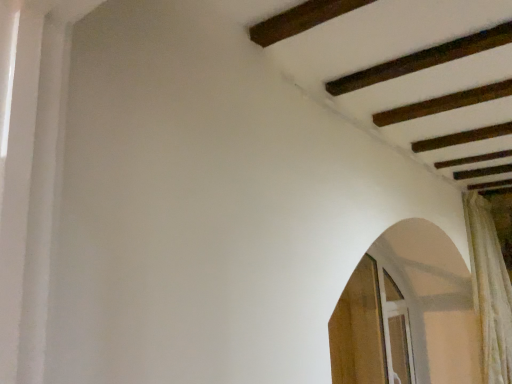
Measure the distance between white textured curtain at right and camera.

white textured curtain at right is 9.02 feet away from camera.

Image resolution: width=512 pixels, height=384 pixels. Describe the element at coordinates (359, 330) in the screenshot. I see `wooden screen door at lower right, the second screen door viewed from the right` at that location.

Find the location of `white textured curtain at right`. white textured curtain at right is located at coordinates (489, 289).

In the scene shown: Is clear glass screen door at lower right, which is counted as the first screen door, starting from the right, turned away from wooden screen door at lower right, positioned as the first screen door in left-to-right order?

Yes, wooden screen door at lower right, positioned as the first screen door in left-to-right order, is at the back of clear glass screen door at lower right, which is counted as the first screen door, starting from the right.

Can you confirm if clear glass screen door at lower right, which is counted as the first screen door, starting from the right, is shorter than wooden screen door at lower right, the second screen door viewed from the right?

Indeed, clear glass screen door at lower right, which is counted as the first screen door, starting from the right, has a lesser height compared to wooden screen door at lower right, the second screen door viewed from the right.

From the image's perspective, is clear glass screen door at lower right, which ranks as the 2th screen door in left-to-right order, above wooden screen door at lower right, positioned as the first screen door in left-to-right order?

No.

How many degrees apart are the facing directions of white textured curtain at right and wooden screen door at lower right, positioned as the first screen door in left-to-right order?

0.694 degrees separate the facing orientations of white textured curtain at right and wooden screen door at lower right, positioned as the first screen door in left-to-right order.

Is there a large distance between white textured curtain at right and wooden screen door at lower right, positioned as the first screen door in left-to-right order?

That's not correct — white textured curtain at right is a little close to wooden screen door at lower right, positioned as the first screen door in left-to-right order.

Considering the sizes of white textured curtain at right and wooden screen door at lower right, the second screen door viewed from the right, in the image, is white textured curtain at right bigger or smaller than wooden screen door at lower right, the second screen door viewed from the right,?

Considering their sizes, white textured curtain at right takes up more space than wooden screen door at lower right, the second screen door viewed from the right.

From their relative heights in the image, would you say white textured curtain at right is taller or shorter than wooden screen door at lower right, the second screen door viewed from the right?

Clearly, white textured curtain at right is taller compared to wooden screen door at lower right, the second screen door viewed from the right.

Which is correct: white textured curtain at right is inside clear glass screen door at lower right, which ranks as the 2th screen door in left-to-right order, or outside of it?

white textured curtain at right is spatially situated outside clear glass screen door at lower right, which ranks as the 2th screen door in left-to-right order.

Which object is thinner, white textured curtain at right or clear glass screen door at lower right, which ranks as the 2th screen door in left-to-right order?

clear glass screen door at lower right, which ranks as the 2th screen door in left-to-right order, is thinner.

Which is less distant, [490,354] or [391,291]?

Point [490,354].

Is white textured curtain at right in front of clear glass screen door at lower right, which is counted as the first screen door, starting from the right?

Yes, white textured curtain at right is closer to the viewer.

Which object is further away from the camera, wooden screen door at lower right, positioned as the first screen door in left-to-right order, or white textured curtain at right?

Positioned behind is white textured curtain at right.

From the image's perspective, is wooden screen door at lower right, positioned as the first screen door in left-to-right order, beneath white textured curtain at right?

Indeed, from the image's perspective, wooden screen door at lower right, positioned as the first screen door in left-to-right order, is shown beneath white textured curtain at right.

Considering the points (367, 357) and (501, 324), which point is behind, point (367, 357) or point (501, 324)?

Positioned behind is point (367, 357).

Which is more to the left, wooden screen door at lower right, the second screen door viewed from the right, or white textured curtain at right?

wooden screen door at lower right, the second screen door viewed from the right, is more to the left.

Is clear glass screen door at lower right, which is counted as the first screen door, starting from the right, turned away from white textured curtain at right?

clear glass screen door at lower right, which is counted as the first screen door, starting from the right, does not have its back to white textured curtain at right.

From a real-world perspective, is clear glass screen door at lower right, which ranks as the 2th screen door in left-to-right order, physically below white textured curtain at right?

Yes, from a real-world perspective, clear glass screen door at lower right, which ranks as the 2th screen door in left-to-right order, is below white textured curtain at right.

Is clear glass screen door at lower right, which is counted as the first screen door, starting from the right, inside or outside of white textured curtain at right?

clear glass screen door at lower right, which is counted as the first screen door, starting from the right, is not enclosed by white textured curtain at right.

Is the depth of clear glass screen door at lower right, which ranks as the 2th screen door in left-to-right order, less than that of white textured curtain at right?

No, clear glass screen door at lower right, which ranks as the 2th screen door in left-to-right order, is further to the viewer.

From a real-world perspective, is wooden screen door at lower right, positioned as the first screen door in left-to-right order, over clear glass screen door at lower right, which ranks as the 2th screen door in left-to-right order?

Yes, from a real-world perspective, wooden screen door at lower right, positioned as the first screen door in left-to-right order, is on top of clear glass screen door at lower right, which ranks as the 2th screen door in left-to-right order.

Which is in front, point (357, 331) or point (399, 323)?

Point (399, 323)

From the image's perspective, is wooden screen door at lower right, the second screen door viewed from the right, positioned above or below clear glass screen door at lower right, which ranks as the 2th screen door in left-to-right order?

wooden screen door at lower right, the second screen door viewed from the right, is situated higher than clear glass screen door at lower right, which ranks as the 2th screen door in left-to-right order, in the image.

Is wooden screen door at lower right, positioned as the first screen door in left-to-right order, facing towards clear glass screen door at lower right, which is counted as the first screen door, starting from the right?

Yes, wooden screen door at lower right, positioned as the first screen door in left-to-right order, is aimed at clear glass screen door at lower right, which is counted as the first screen door, starting from the right.

The height and width of the screenshot is (384, 512). I want to click on screen door lying on the left of clear glass screen door at lower right, which is counted as the first screen door, starting from the right, so click(x=359, y=330).

You are a GUI agent. You are given a task and a screenshot of the screen. Output one action in this format:
    pyautogui.click(x=<x>, y=<y>)
    Task: Click on the 1st screen door below when counting from the white textured curtain at right (from the image's perspective)
    Image resolution: width=512 pixels, height=384 pixels.
    Given the screenshot: What is the action you would take?
    pyautogui.click(x=359, y=330)

Estimate the real-world distances between objects in this image. Which object is further from white textured curtain at right, clear glass screen door at lower right, which is counted as the first screen door, starting from the right, or wooden screen door at lower right, positioned as the first screen door in left-to-right order?

wooden screen door at lower right, positioned as the first screen door in left-to-right order.

Estimate the real-world distances between objects in this image. Which object is further from white textured curtain at right, wooden screen door at lower right, the second screen door viewed from the right, or clear glass screen door at lower right, which ranks as the 2th screen door in left-to-right order?

The object further to white textured curtain at right is wooden screen door at lower right, the second screen door viewed from the right.

Which object lies nearer to the anchor point wooden screen door at lower right, the second screen door viewed from the right, white textured curtain at right or clear glass screen door at lower right, which is counted as the first screen door, starting from the right?

Among the two, clear glass screen door at lower right, which is counted as the first screen door, starting from the right, is located nearer to wooden screen door at lower right, the second screen door viewed from the right.

Based on their spatial positions, is wooden screen door at lower right, the second screen door viewed from the right, or white textured curtain at right further from clear glass screen door at lower right, which ranks as the 2th screen door in left-to-right order?

Based on the image, white textured curtain at right appears to be further to clear glass screen door at lower right, which ranks as the 2th screen door in left-to-right order.

From the image, which object appears to be farther from clear glass screen door at lower right, which is counted as the first screen door, starting from the right, white textured curtain at right or wooden screen door at lower right, positioned as the first screen door in left-to-right order?

white textured curtain at right is further to clear glass screen door at lower right, which is counted as the first screen door, starting from the right.

From the image, which object appears to be farther from wooden screen door at lower right, positioned as the first screen door in left-to-right order, clear glass screen door at lower right, which is counted as the first screen door, starting from the right, or white textured curtain at right?

Based on the image, white textured curtain at right appears to be further to wooden screen door at lower right, positioned as the first screen door in left-to-right order.

What are the coordinates of `screen door between wooden screen door at lower right, the second screen door viewed from the right, and white textured curtain at right` in the screenshot? It's located at (398, 333).